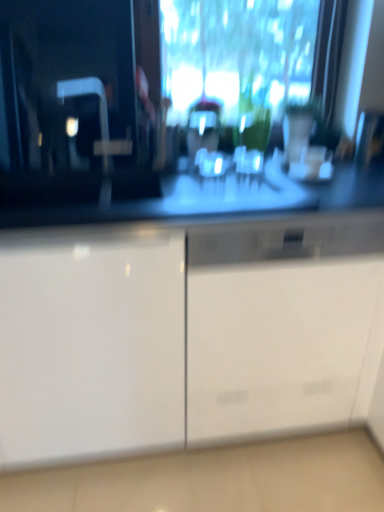
The image size is (384, 512). I want to click on free space above white glossy cabinet at center (from a real-world perspective), so click(298, 224).